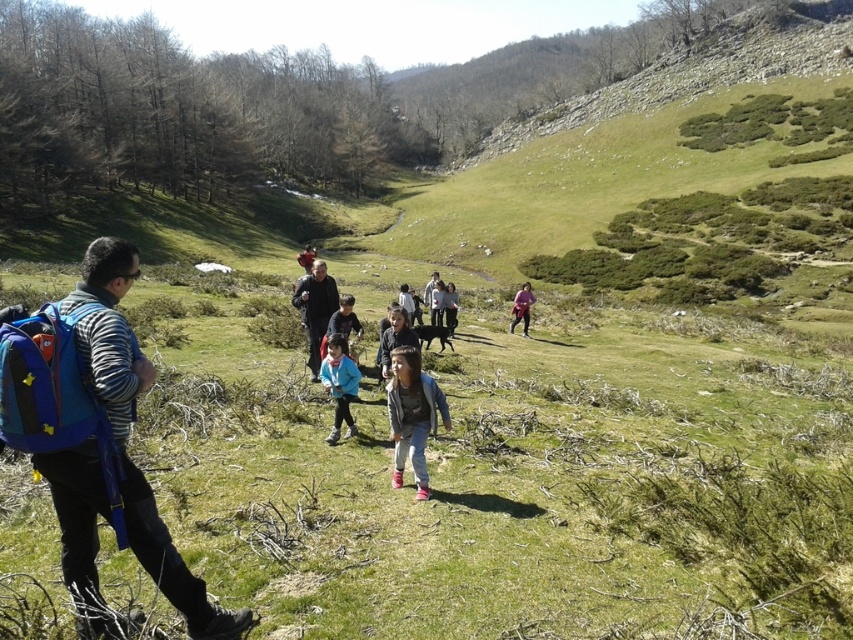
Question: Does blue fabric backpack at left come behind blue fleece jacket at center?

Choices:
 (A) yes
 (B) no

Answer: (B)

Question: Where is denim jacket at center located in relation to light blue fabric jacket at center in the image?

Choices:
 (A) left
 (B) right

Answer: (B)

Question: Is denim jacket at center smaller than black fabric jacket at center?

Choices:
 (A) no
 (B) yes

Answer: (B)

Question: Based on their relative distances, which object is farther from the blue fleece jacket at center?

Choices:
 (A) light brown hair at center
 (B) light blue fabric jacket at center
 (C) pink fabric at center
 (D) light gray sweater at center

Answer: (C)

Question: Which object is the closest to the light blue fabric jacket at center?

Choices:
 (A) light brown hair at center
 (B) blue fleece jacket at center

Answer: (A)

Question: Estimate the real-world distances between objects in this image. Which object is farther from the denim jacket at center?

Choices:
 (A) light brown hair at center
 (B) pink fabric at center

Answer: (B)